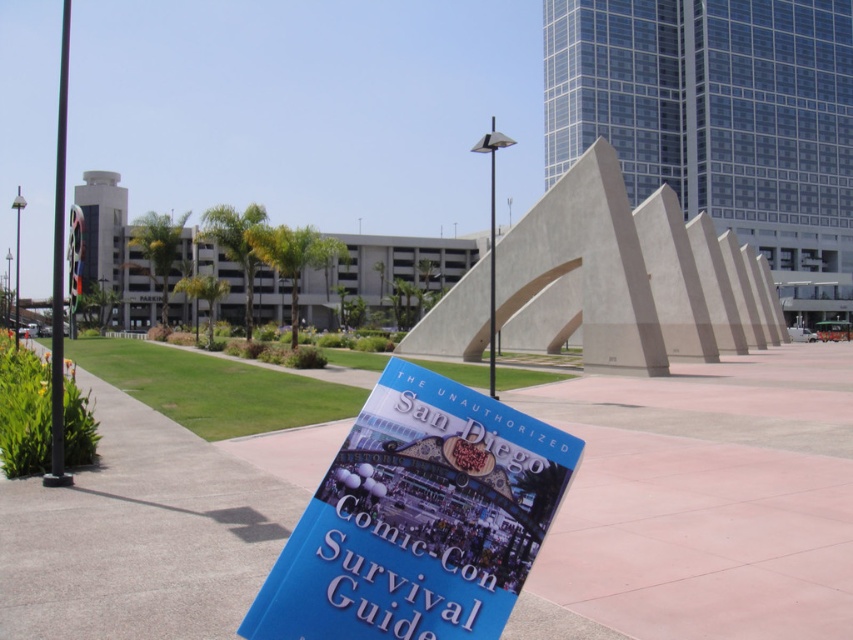
Question: Which point is farther from the camera taking this photo?

Choices:
 (A) (494, 186)
 (B) (57, 216)

Answer: (A)

Question: Which of the following is the closest to the observer?

Choices:
 (A) (490, 378)
 (B) (65, 483)

Answer: (B)

Question: Is blue paper book at center to the left of black metal pole at left from the viewer's perspective?

Choices:
 (A) yes
 (B) no

Answer: (B)

Question: Considering the real-world distances, which object is farthest from the blue paper book at center?

Choices:
 (A) metallic pole at center
 (B) black metal pole at left

Answer: (A)

Question: Can you confirm if black metal pole at left is positioned above metallic pole at center?

Choices:
 (A) yes
 (B) no

Answer: (A)

Question: From the image, what is the correct spatial relationship of blue paper book at center in relation to metallic pole at center?

Choices:
 (A) left
 (B) right

Answer: (A)